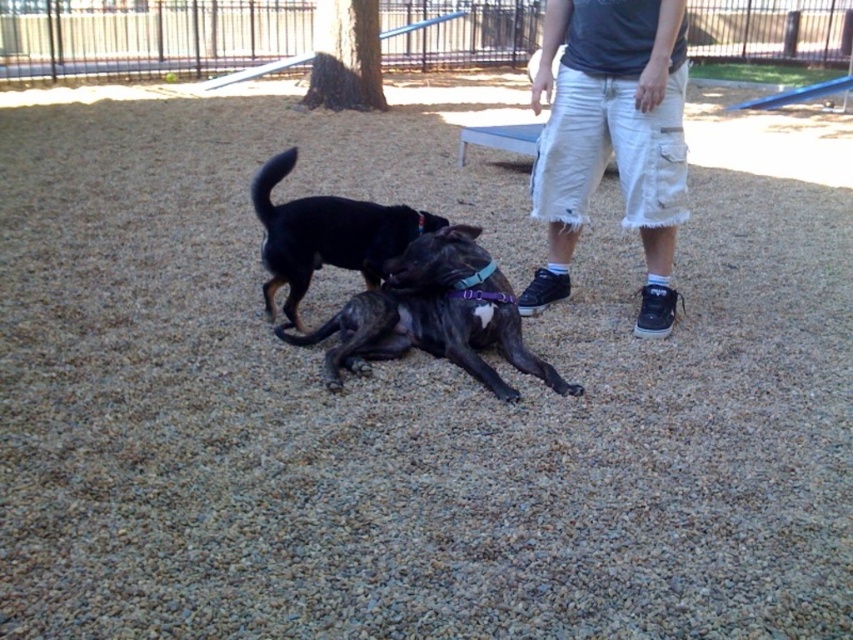
You are a photographer standing at the edge of the dog park. You want to take a photo of the black matte dog at center without including the white cotton shorts at right in the frame. Is this possible based on their positions?

The white cotton shorts at right is in front of the black matte dog at center, so it would block the view. Therefore, you cannot take a photo of the black matte dog at center without including the white cotton shorts at right in the frame.

You are a photographer trying to capture a photo of the brindle fur dog at center and the white cotton shorts at right. Based on their heights, which object would you need to adjust your camera angle upwards to focus on?

The white cotton shorts at right is much taller than the brindle fur dog at center, so you would need to adjust your camera angle upwards to focus on the white cotton shorts at right.

You are a photographer trying to capture a clear shot of the black matte dog at center and the white cotton shorts at right. Since you want both subjects to be in focus, you need to know which one is closer to you. Can you determine which object is nearer based on their sizes?

The white cotton shorts at right is thinner than the black matte dog at center, so the white cotton shorts at right is farther away from you, meaning the black matte dog at center is closer to you.